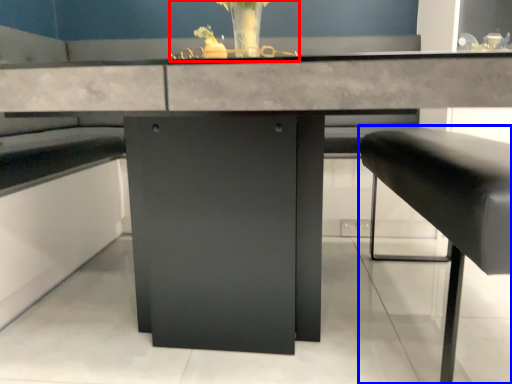
Question: Among these objects, which one is farthest to the camera, floral arrangement (highlighted by a red box) or furniture (highlighted by a blue box)?

Choices:
 (A) floral arrangement
 (B) furniture

Answer: (A)